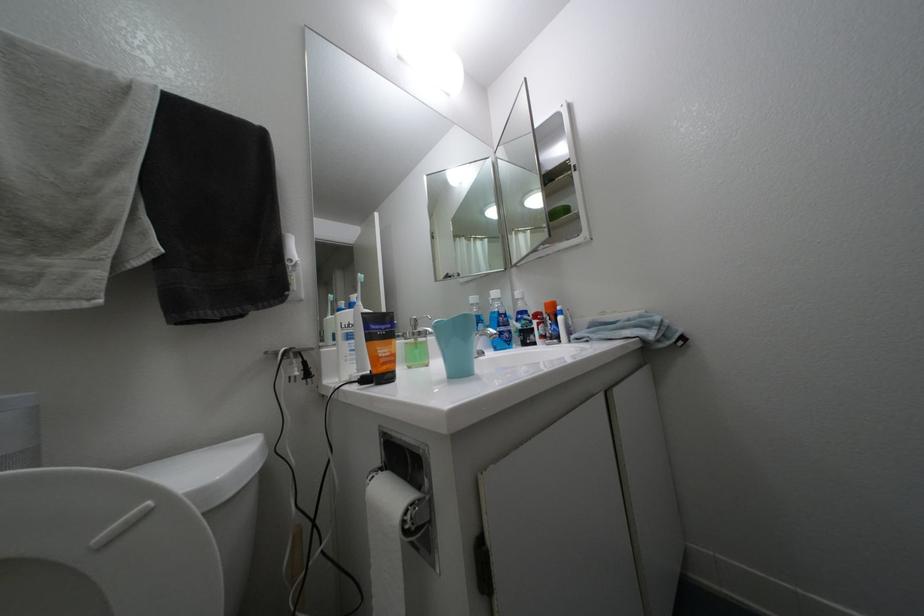
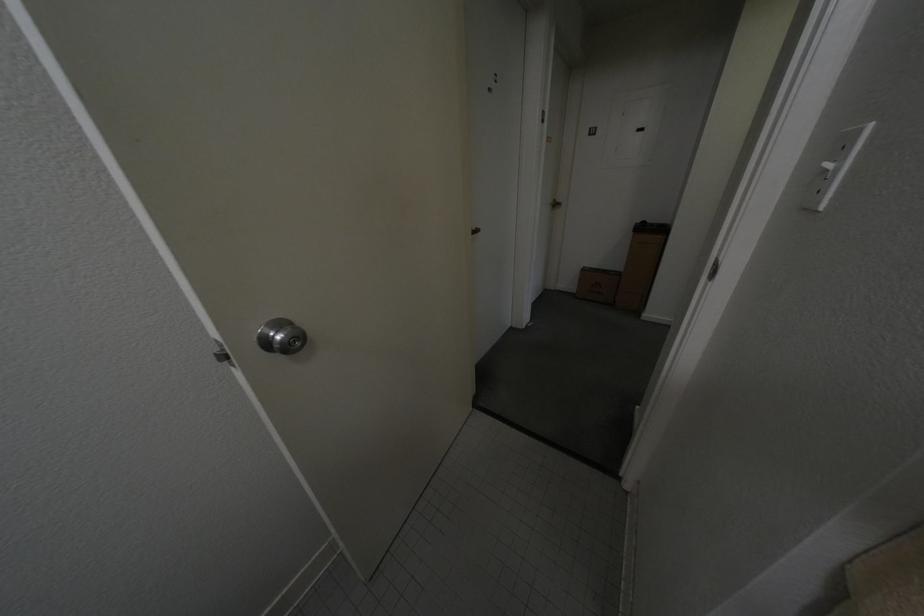
First-person continuous shooting, in which direction is the camera rotating?

The camera rotated toward right-down.